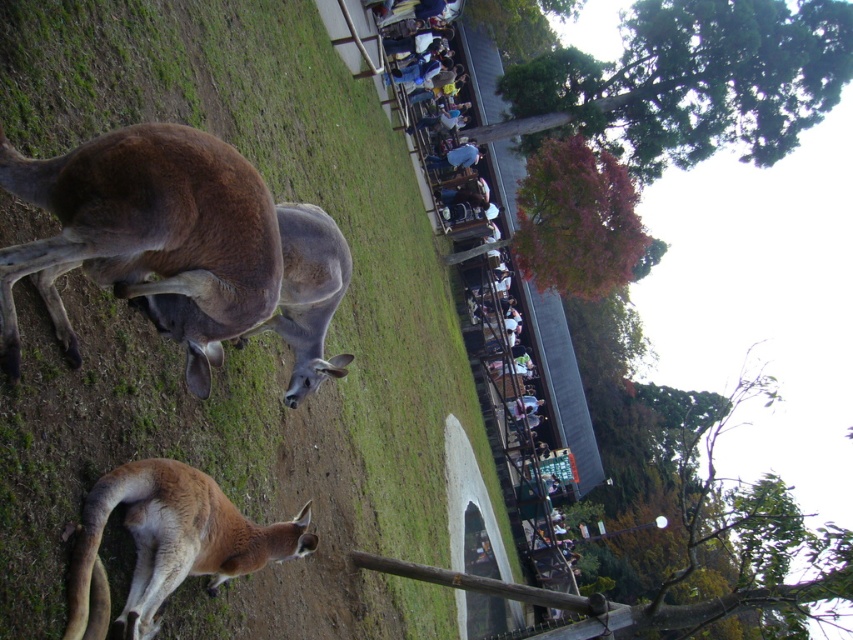
Question: Is brown fur kangaroo at lower left positioned in front of brown fur kangaroo at center?

Choices:
 (A) no
 (B) yes

Answer: (B)

Question: Which of the following is the closest to the observer?

Choices:
 (A) brown furry kangaroo at center
 (B) light brown fur at center

Answer: (A)

Question: Which object appears closest to the camera in this image?

Choices:
 (A) light brown fur at center
 (B) brown fur kangaroo at lower left

Answer: (B)

Question: Does brown furry kangaroo at center appear on the left side of brown fur kangaroo at lower left?

Choices:
 (A) yes
 (B) no

Answer: (A)

Question: Which point is farther to the camera?

Choices:
 (A) (178, 202)
 (B) (71, 564)
 (C) (250, 483)
 (D) (318, 381)

Answer: (D)

Question: Is green grass at lower left above brown fur kangaroo at lower left?

Choices:
 (A) no
 (B) yes

Answer: (B)